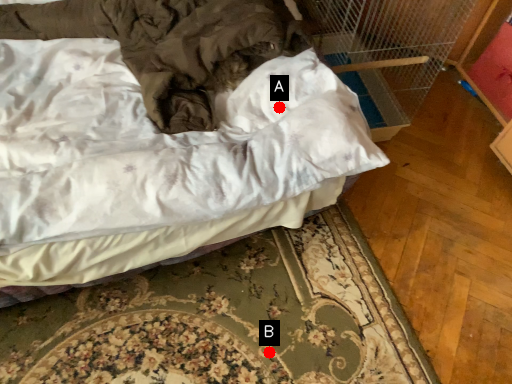
Question: Two points are circled on the image, labeled by A and B beside each circle. Which point is further to the camera?

Choices:
 (A) A is further
 (B) B is further

Answer: (B)